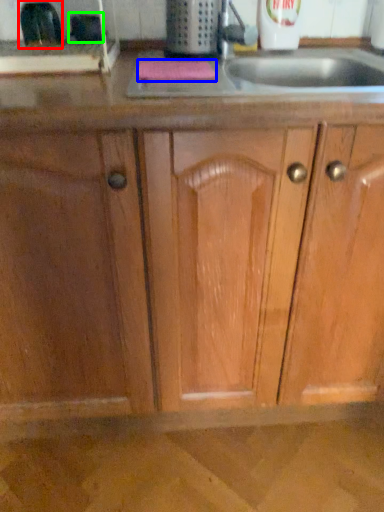
Question: Considering the real-world distances, which object is closest to appliance (highlighted by a red box)? soap (highlighted by a blue box) or appliance (highlighted by a green box).

Choices:
 (A) soap
 (B) appliance

Answer: (B)